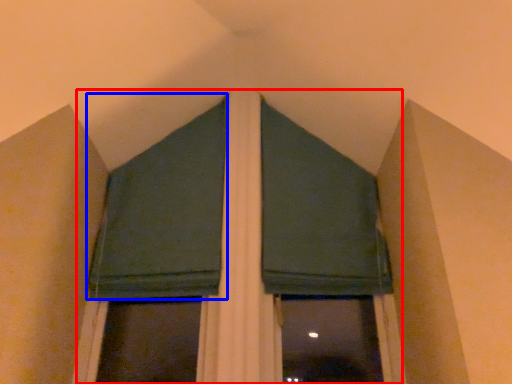
Question: Which of the following is the farthest to the observer, bay window (highlighted by a red box) or curtain (highlighted by a blue box)?

Choices:
 (A) bay window
 (B) curtain

Answer: (B)